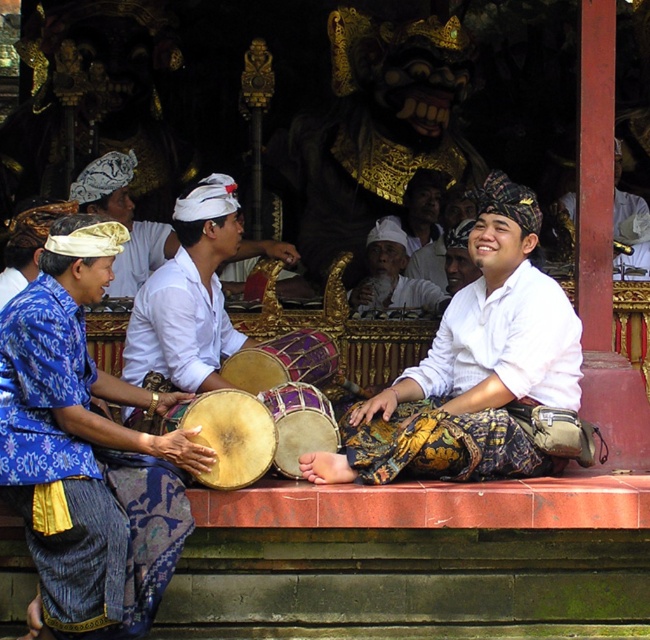
Question: Can you confirm if white cotton hat at center is bigger than purple wooden drum at center?

Choices:
 (A) no
 (B) yes

Answer: (B)

Question: Considering the real-world distances, which object is closest to the natural wood drum at center?

Choices:
 (A) white cotton shirt at center
 (B) white matte drum at center
 (C) purple fabric drum at center

Answer: (A)

Question: Based on their relative distances, which object is farther from the white cotton shirt at right?

Choices:
 (A) purple wooden drum at center
 (B) purple fabric drum at center
 (C) natural wood drum at center
 (D) white cotton hat at center

Answer: (C)

Question: Which object appears farthest from the camera in this image?

Choices:
 (A) natural wood drum at center
 (B) purple fabric drum at center

Answer: (B)

Question: Can you confirm if white matte drum at center is wider than purple wooden drum at center?

Choices:
 (A) yes
 (B) no

Answer: (A)

Question: Can you confirm if natural wood drum at center is positioned to the right of white cotton shirt at right?

Choices:
 (A) no
 (B) yes

Answer: (A)